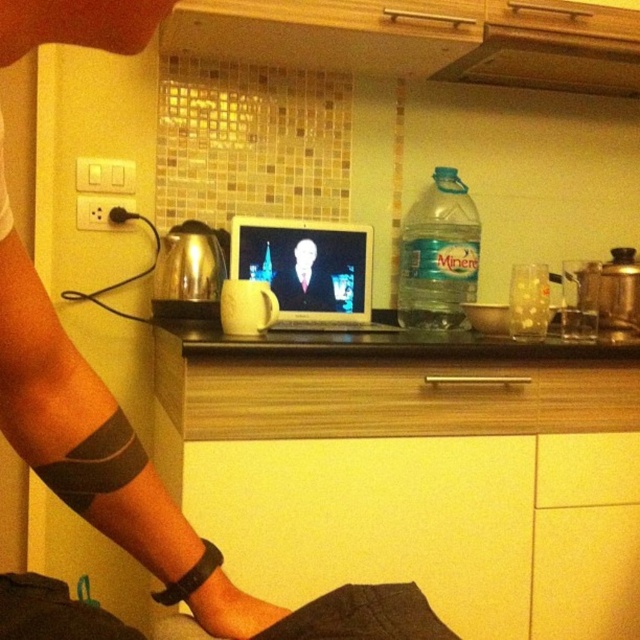
Question: Can you confirm if black glossy laptop at center is bigger than translucent plastic water bottle at right?

Choices:
 (A) no
 (B) yes

Answer: (B)

Question: Which of the following is the farthest from the observer?

Choices:
 (A) translucent plastic water bottle at right
 (B) smooth skin man at center

Answer: (A)

Question: Estimate the real-world distances between objects in this image. Which object is farther from the black glossy laptop at center?

Choices:
 (A) smooth skin man at center
 (B) translucent plastic water bottle at right
 (C) wooden drawer at center

Answer: (A)

Question: Does wooden drawer at center have a smaller size compared to black fabric sandal at lower left?

Choices:
 (A) no
 (B) yes

Answer: (A)

Question: Which is nearer to the smooth skin man at center?

Choices:
 (A) matte black laptop at upper center
 (B) white glossy laptop at center

Answer: (B)

Question: In this image, where is white glossy laptop at center located relative to smooth skin man at center?

Choices:
 (A) above
 (B) below

Answer: (A)